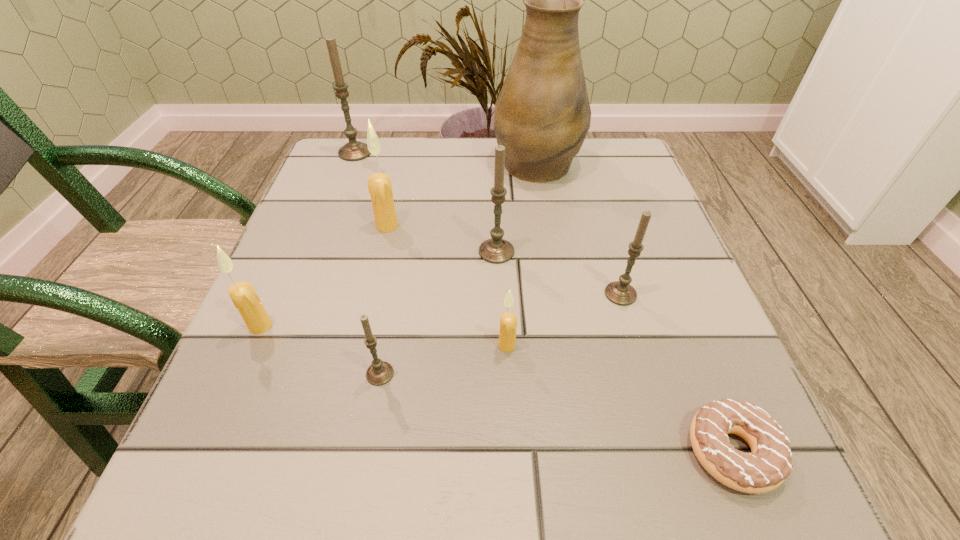
Identify the location of free space between the third biggest gray candle and the doughnut. The image size is (960, 540). (676, 373).

You are a GUI agent. You are given a task and a screenshot of the screen. Output one action in this format:
    pyautogui.click(x=<x>, y=<y>)
    Task: Click on the free area in between the second gray candle from left to right and the farthest candle
    
    Given the screenshot: What is the action you would take?
    pyautogui.click(x=368, y=263)

Choose which object is the sixth nearest neighbor to the seventh nearest object. Please provide its 2D coordinates. Your answer should be formatted as a tuple, i.e. [(x, y)], where the tuple contains the x and y coordinates of a point satisfying the conditions above.

[(508, 321)]

Choose which object is the sixth nearest neighbor to the third farthest gray candle. Please provide its 2D coordinates. Your answer should be formatted as a tuple, i.e. [(x, y)], where the tuple contains the x and y coordinates of a point satisfying the conditions above.

[(379, 184)]

The height and width of the screenshot is (540, 960). In order to click on candle that is the third closest to the biggest gray candle in this screenshot , I will do `click(243, 295)`.

Select which candle appears as the fourth closest to the shortest object. Please provide its 2D coordinates. Your answer should be formatted as a tuple, i.e. [(x, y)], where the tuple contains the x and y coordinates of a point satisfying the conditions above.

[(380, 372)]

In order to click on gray candle that is the third nearest to the sixth nearest object in this screenshot , I will do `click(354, 150)`.

At what (x,y) coordinates should I click in order to perform the action: click on the second closest gray candle to the tallest object. Please return your answer as a coordinate pair (x, y). Looking at the image, I should click on (620, 292).

Identify the location of cream candle that stands as the closest to the biggest cream candle. (243, 295).

This screenshot has height=540, width=960. I want to click on cream candle that is the third nearest to the nearest candle, so click(x=379, y=184).